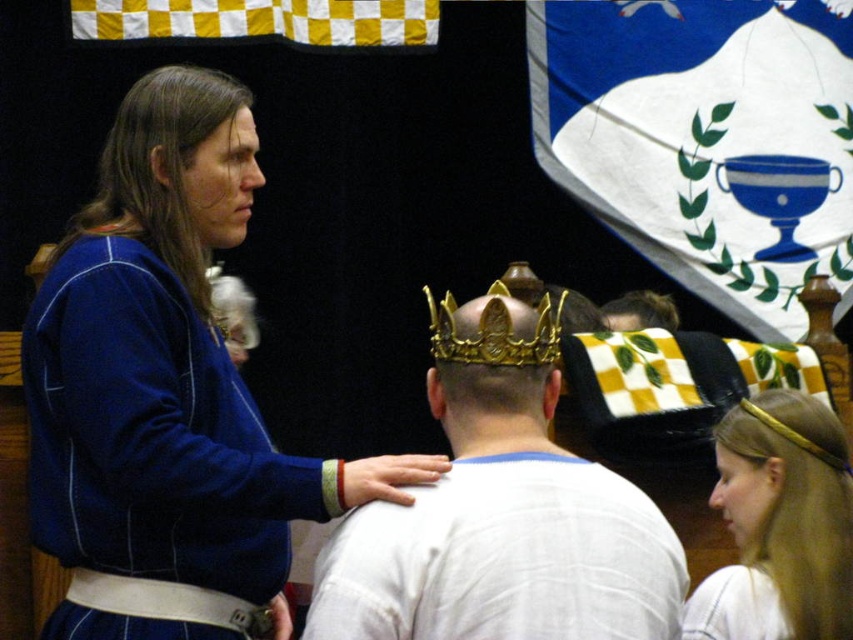
You are a knight standing at the edge of a courtyard where two shiny gold crowns are displayed. You need to retrieve one of them for a ceremony. Given that your reach extends 10 feet forward, can you grab either of the gold metallic crown at center or shiny gold crown at center without moving closer?

The distance between the gold metallic crown at center and the shiny gold crown at center is 16.93 feet. Since your reach is only 10 feet, you cannot grab either of them without moving closer.

You are standing at the point marked as point (x=718, y=611) in the image. You want to move to the nearest tree, which is located 10 meters away from you. However, there is an obstacle 5 meters away in your path. Can you safely navigate around the obstacle to reach the tree without going beyond the 10 meter distance?

Since the obstacle is 5 meters away and the tree is 10 meters away, you can go around the obstacle by moving sideways while maintaining a path within the remaining 5 meters to reach the tree safely.

You are a guest at this medieval event and want to take a photo of both the blue tunic person and the crowned individual without blocking anyone. You notice two spots marked by coordinates. The first spot is at point (790,490) and the second is at point (650,291). Which coordinate allows you to stand closer to the subjects while still being behind them?

Point (790,490) is in front of point (650,291). Therefore, to stand behind the subjects, you should choose point (650,291) as it is further back and allows you to be behind them without blocking the view.